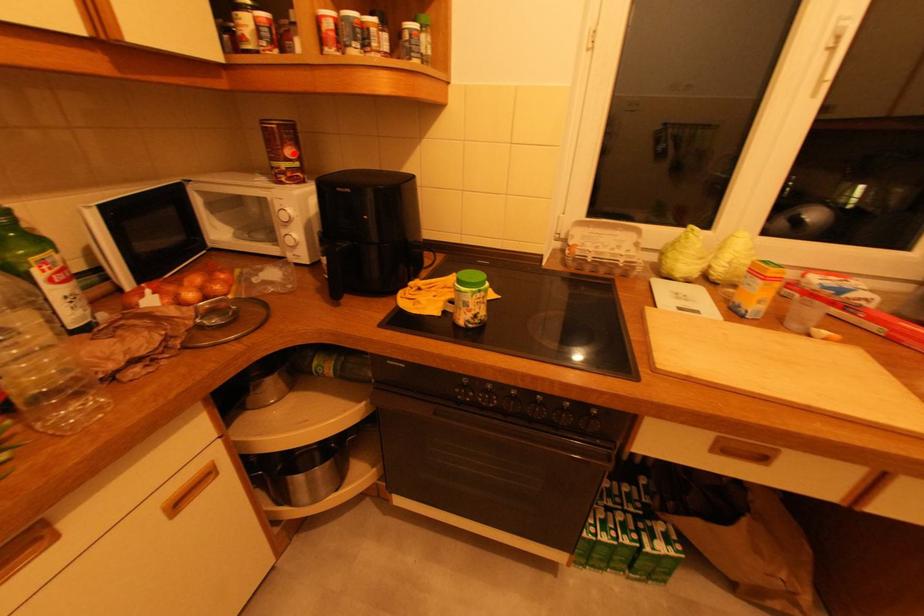
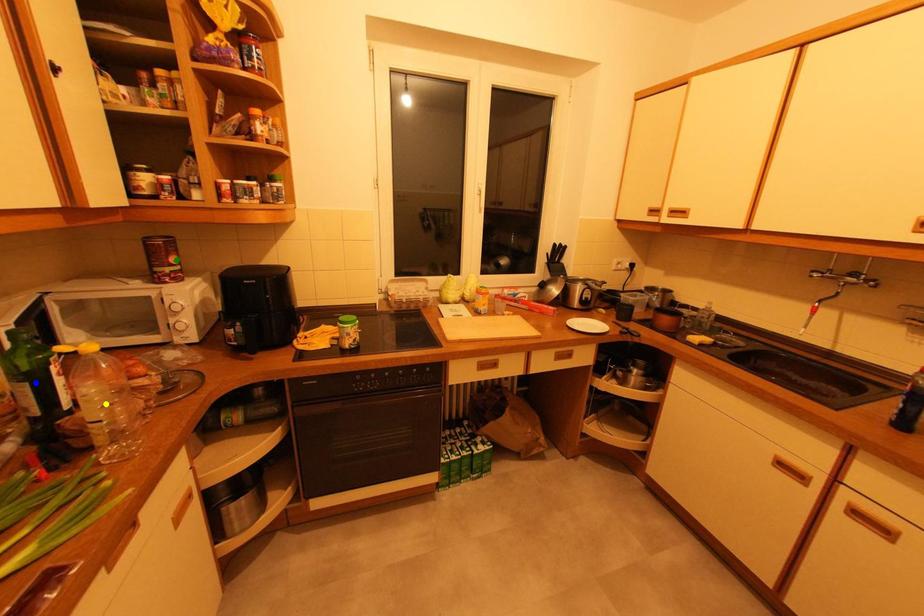
Question: I am providing you with two images of the same scene from different viewpoints. A red point is marked on the first image. You are given multiple points on the second image. Can you choose the point in image 2 that corresponds to the point in image 1?

Choices:
 (A) green point
 (B) blue point
 (C) yellow point

Answer: (A)